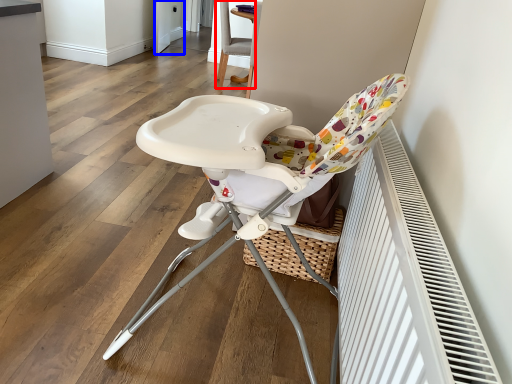
Question: Which object is further to the camera taking this photo, chair (highlighted by a red box) or screen door (highlighted by a blue box)?

Choices:
 (A) chair
 (B) screen door

Answer: (B)